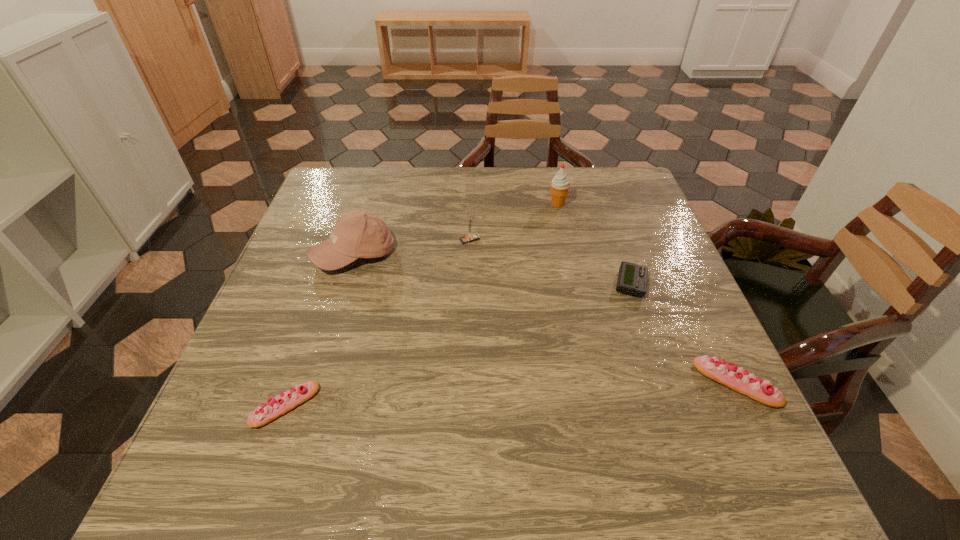
Identify which object is the fourth nearest to the taller eclair. Please provide its 2D coordinates. Your answer should be formatted as a tuple, i.e. [(x, y)], where the tuple contains the x and y coordinates of a point satisfying the conditions above.

[(357, 234)]